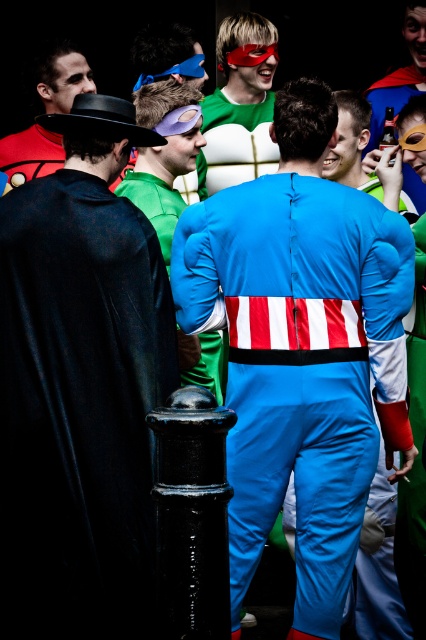
The height and width of the screenshot is (640, 426). Find the location of `blue spandex suit at center`. blue spandex suit at center is located at coordinates (302, 349).

From the picture: Is blue spandex suit at center positioned before matte black mask at upper left?

That is True.

What do you see at coordinates (302, 349) in the screenshot? I see `blue spandex suit at center` at bounding box center [302, 349].

The width and height of the screenshot is (426, 640). What are the coordinates of `blue spandex suit at center` in the screenshot? It's located at (302, 349).

From the picture: Can you confirm if black velvet cape at left is positioned to the right of matte black mask at upper left?

Correct, you'll find black velvet cape at left to the right of matte black mask at upper left.

Is black velvet cape at left positioned in front of matte black mask at upper left?

That is True.

This screenshot has width=426, height=640. What do you see at coordinates (78, 408) in the screenshot?
I see `black velvet cape at left` at bounding box center [78, 408].

Where is `black velvet cape at left`? This screenshot has height=640, width=426. black velvet cape at left is located at coordinates (78, 408).

How far apart are blue spandex suit at center and green fabric mask at upper center?

blue spandex suit at center and green fabric mask at upper center are 11.63 feet apart from each other.

Which is in front, point (311, 470) or point (207, 182)?

Point (311, 470)

Who is more distant from viewer, (x=201, y=275) or (x=247, y=100)?

Point (x=247, y=100)

This screenshot has height=640, width=426. Find the location of `blue spandex suit at center`. blue spandex suit at center is located at coordinates (302, 349).